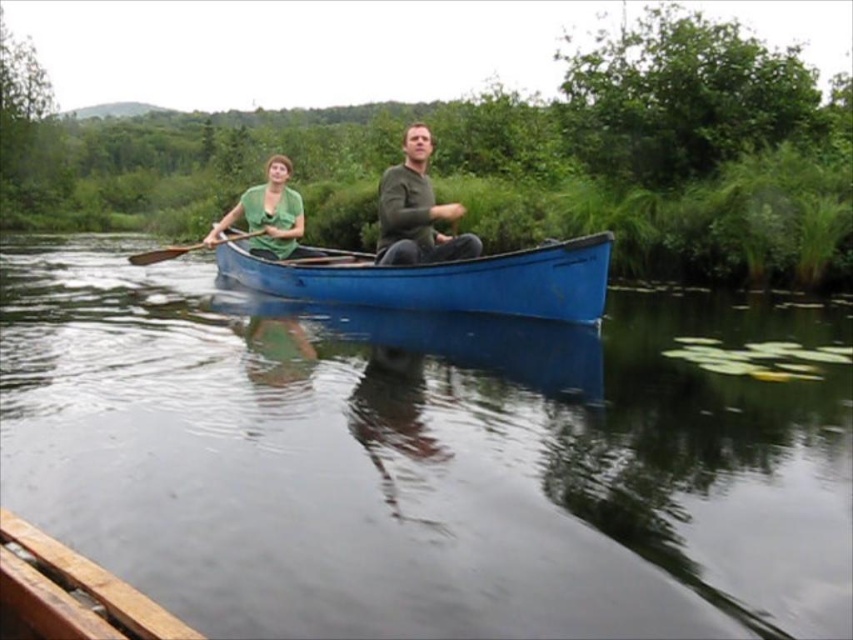
Question: Is matte green shirt at center below matte green sweater at center?

Choices:
 (A) no
 (B) yes

Answer: (A)

Question: Does green matte shirt at center appear on the left side of wooden paddle at center?

Choices:
 (A) yes
 (B) no

Answer: (B)

Question: Which object appears farthest from the camera in this image?

Choices:
 (A) wooden paddle at center
 (B) blue plastic canoe at center
 (C) matte green sweater at center
 (D) matte green shirt at center

Answer: (B)

Question: From the image, what is the correct spatial relationship of blue smooth water at center in relation to matte green shirt at center?

Choices:
 (A) right
 (B) left

Answer: (A)

Question: Among these points, which one is nearest to the camera?

Choices:
 (A) (215, 241)
 (B) (235, 241)
 (C) (358, 368)

Answer: (C)

Question: Which object is farther from the camera taking this photo?

Choices:
 (A) blue smooth water at center
 (B) green matte shirt at center

Answer: (B)